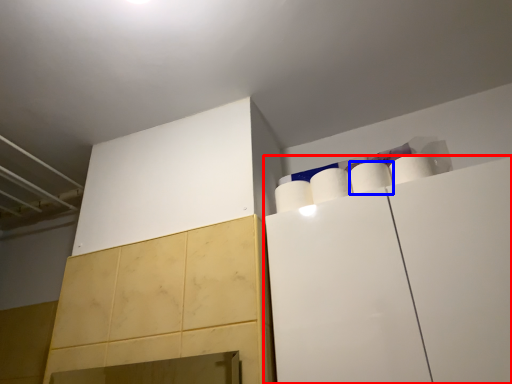
Question: Which point is closer to the camera, cabinetry (highlighted by a red box) or paper towel (highlighted by a blue box)?

Choices:
 (A) cabinetry
 (B) paper towel

Answer: (A)